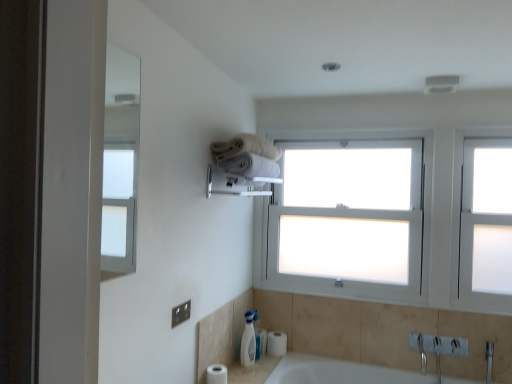
Question: Is white matte toilet paper at lower left, the 1th toilet paper viewed from the front, further to camera compared to white ceramic sink at lower right?

Choices:
 (A) no
 (B) yes

Answer: (B)

Question: Is white matte toilet paper at lower left, the 2th toilet paper viewed from the back, next to white ceramic sink at lower right and touching it?

Choices:
 (A) no
 (B) yes

Answer: (A)

Question: Is white matte toilet paper at lower left, which appears as the 2th toilet paper when viewed from the right, facing away from white ceramic sink at lower right?

Choices:
 (A) no
 (B) yes

Answer: (A)

Question: Is white matte toilet paper at lower left, which is counted as the 1th toilet paper, starting from the left, oriented towards white ceramic sink at lower right?

Choices:
 (A) no
 (B) yes

Answer: (A)

Question: Can you confirm if white matte toilet paper at lower left, which is counted as the 1th toilet paper, starting from the left, is shorter than white ceramic sink at lower right?

Choices:
 (A) no
 (B) yes

Answer: (B)

Question: Is white ceramic sink at lower center in front of or behind white glossy soap dispenser at lower center in the image?

Choices:
 (A) behind
 (B) front

Answer: (B)

Question: From the image's perspective, relative to white glossy soap dispenser at lower center, is white ceramic sink at lower center above or below?

Choices:
 (A) below
 (B) above

Answer: (A)

Question: From a real-world perspective, relative to white glossy soap dispenser at lower center, is white ceramic sink at lower center vertically above or below?

Choices:
 (A) above
 (B) below

Answer: (B)

Question: Is point (248, 369) positioned closer to the camera than point (242, 359)?

Choices:
 (A) closer
 (B) farther

Answer: (B)

Question: Considering the positions of point (509, 168) and point (295, 263), is point (509, 168) closer or farther from the camera than point (295, 263)?

Choices:
 (A) closer
 (B) farther

Answer: (A)

Question: From a real-world perspective, is frosted glass window at right physically located above or below white frosted glass window at center?

Choices:
 (A) below
 (B) above

Answer: (A)

Question: From the image's perspective, relative to white frosted glass window at center, is frosted glass window at right above or below?

Choices:
 (A) below
 (B) above

Answer: (A)

Question: Looking at their shapes, would you say frosted glass window at right is wider or thinner than white frosted glass window at center?

Choices:
 (A) wide
 (B) thin

Answer: (A)

Question: In terms of height, does white glossy soap dispenser at lower center look taller or shorter compared to white ceramic sink at lower center?

Choices:
 (A) tall
 (B) short

Answer: (A)

Question: In terms of width, does white glossy soap dispenser at lower center look wider or thinner when compared to white ceramic sink at lower center?

Choices:
 (A) wide
 (B) thin

Answer: (B)